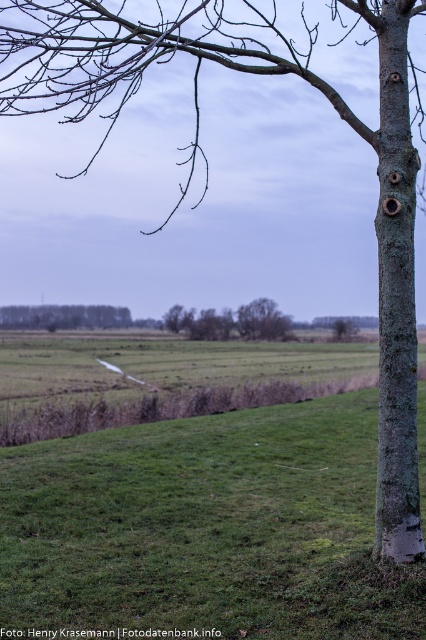
You are a hiker standing at the edge of the green grassy field at lower left, looking towards the brown rough tree at center. Which object is taller when comparing the two?

The brown rough tree at center is taller than the green grassy field at lower left.

You are a hiker trying to identify the tallest tree between the green mossy bark tree trunk at right and the brown rough tree at center. Based on the scene, which tree should you consider as the taller one?

The green mossy bark tree trunk at right is taller than the brown rough tree at center, so you should consider the green mossy bark tree trunk at right as the taller one.

You are standing in a rural landscape and want to take a photo of the green mossy bark tree trunk at right. If you are currently 18.26 feet away from it, will you be able to capture the entire tree trunk in your camera frame without moving closer or farther?

The green mossy bark tree trunk at right is exactly 18.26 feet away from the viewer. To determine if it can be captured fully in the camera frame without adjusting distance, you would need to know the camera sensor size, focal length, and the actual height of the tree trunk. However, based on the provided information alone, it is not possible to confirm whether the entire tree trunk will fit in the frame.